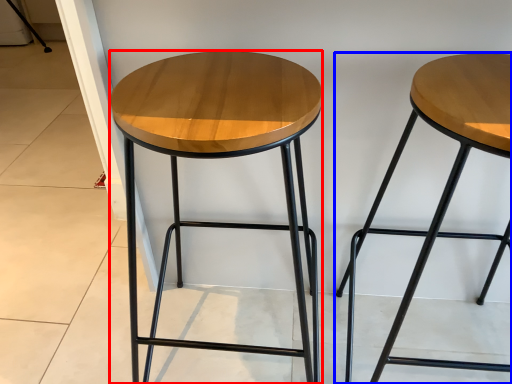
Question: Which object is further to the camera taking this photo, stool (highlighted by a red box) or stool (highlighted by a blue box)?

Choices:
 (A) stool
 (B) stool

Answer: (A)